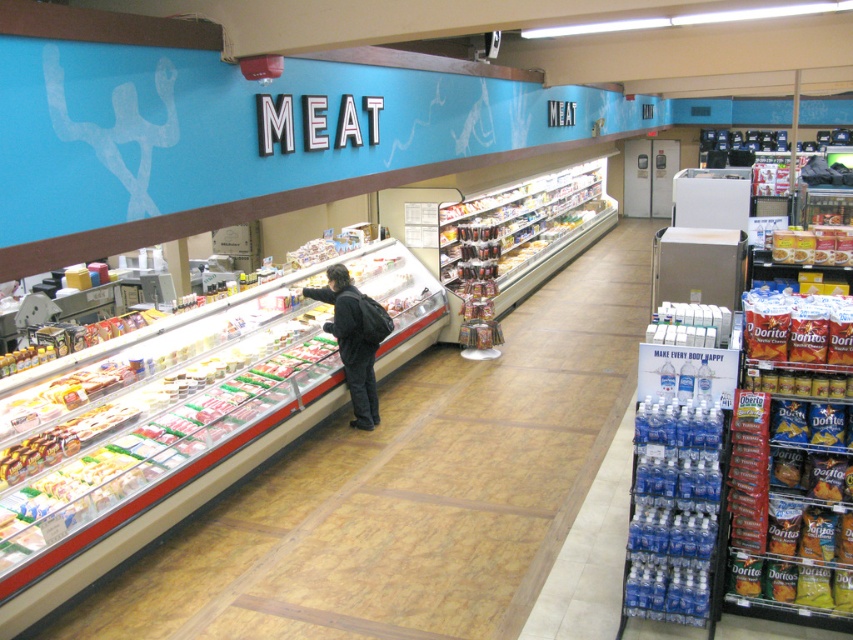
Question: Can you confirm if clear plastic deli case at center is positioned above dark gray backpack at center?

Choices:
 (A) yes
 (B) no

Answer: (B)

Question: Which object is farther from the camera taking this photo?

Choices:
 (A) clear plastic deli case at center
 (B) dark gray backpack at center

Answer: (B)

Question: Which of the following is the farthest from the observer?

Choices:
 (A) (315, 292)
 (B) (283, 588)

Answer: (A)

Question: Among these objects, which one is farthest from the camera?

Choices:
 (A) dark gray backpack at center
 (B) clear plastic deli case at center

Answer: (A)

Question: Does clear plastic deli case at center have a smaller size compared to dark gray backpack at center?

Choices:
 (A) yes
 (B) no

Answer: (B)

Question: Is clear plastic deli case at center above dark gray backpack at center?

Choices:
 (A) no
 (B) yes

Answer: (A)